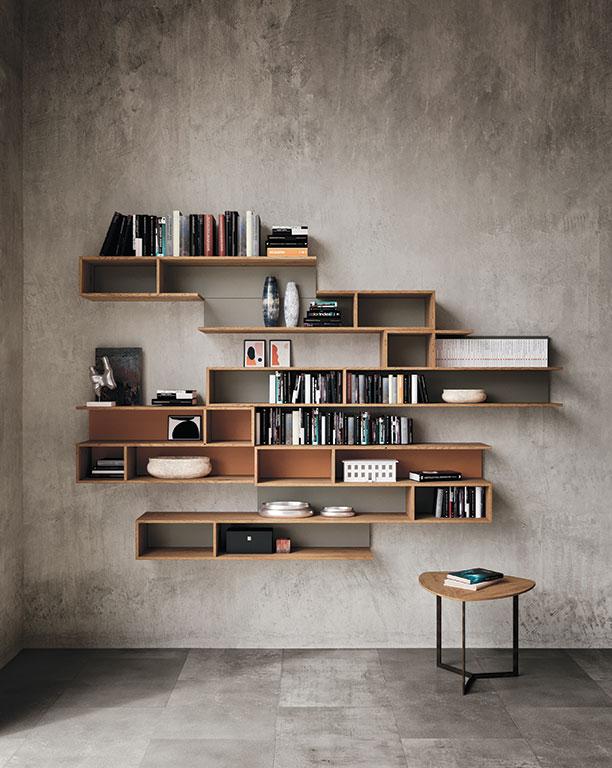
Where is `framed art`? framed art is located at coordinates pyautogui.click(x=181, y=425), pyautogui.click(x=131, y=386), pyautogui.click(x=459, y=356), pyautogui.click(x=282, y=353), pyautogui.click(x=253, y=353).